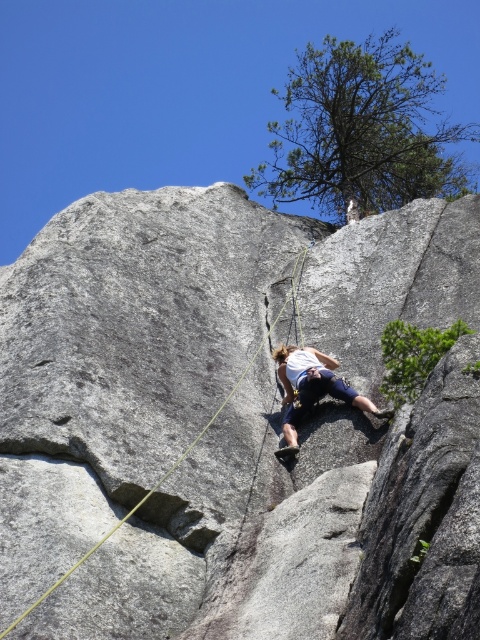
Question: Which point is farther from the camera taking this photo?

Choices:
 (A) (362, 381)
 (B) (304, 368)

Answer: (B)

Question: Which of the following is the closest to the observer?

Choices:
 (A) (336, 404)
 (B) (287, 365)

Answer: (A)

Question: Where is gray rock at center located in relation to white fabric climbing harness at center in the image?

Choices:
 (A) below
 (B) above

Answer: (B)

Question: Does gray rock at center appear on the left side of white fabric climbing harness at center?

Choices:
 (A) no
 (B) yes

Answer: (B)

Question: Is gray rock at center positioned at the back of white fabric climbing harness at center?

Choices:
 (A) yes
 (B) no

Answer: (B)